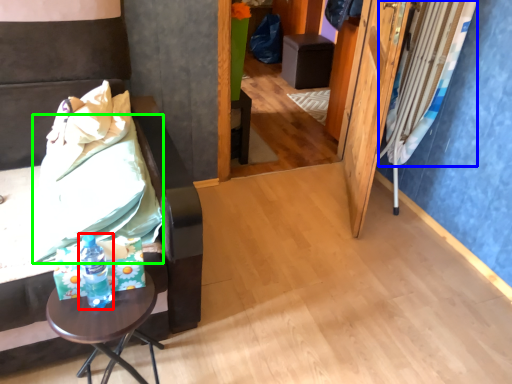
Question: Which object is positioned farthest from bottle (highlighted by a red box)? Select from curtain (highlighted by a blue box) and sheet (highlighted by a green box).

Choices:
 (A) curtain
 (B) sheet

Answer: (A)